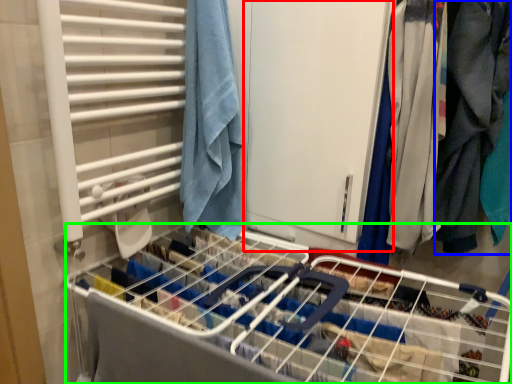
Question: Considering the real-world distances, which object is closest to screen door (highlighted by a red box)? clothing (highlighted by a blue box) or bed frame (highlighted by a green box).

Choices:
 (A) clothing
 (B) bed frame

Answer: (A)